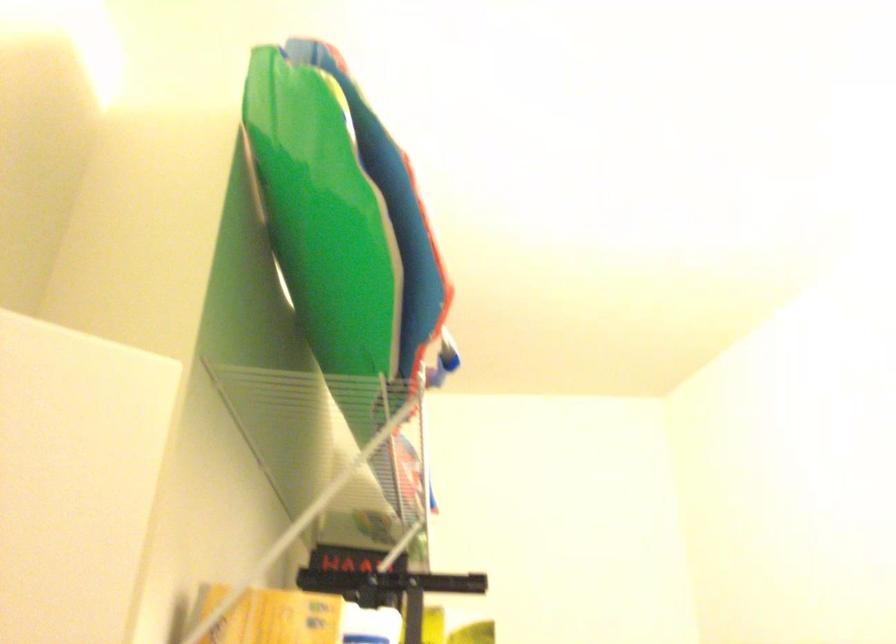
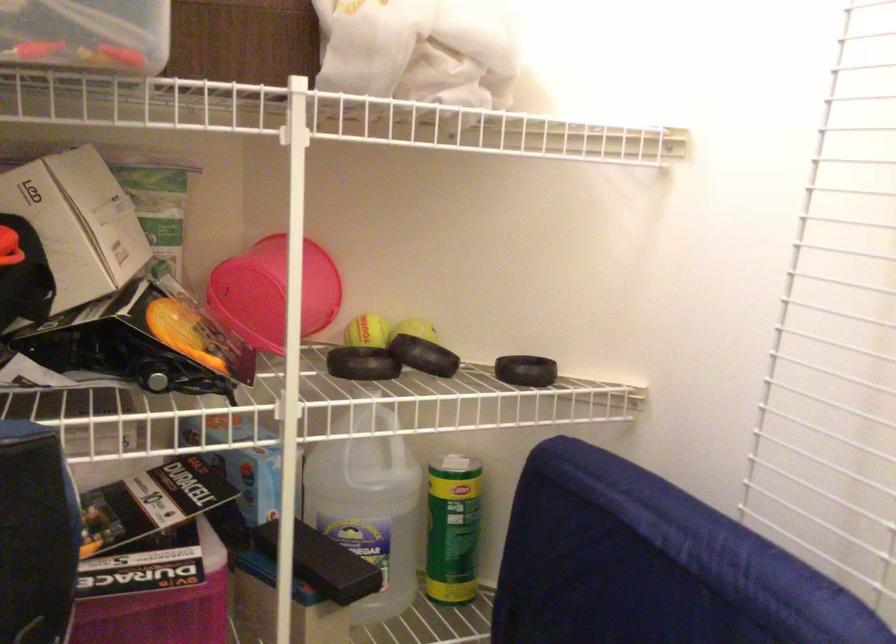
Question: The camera is either moving clockwise (left) or counter-clockwise (right) around the object. The first image is from the beginning of the video and the second image is from the end. Is the camera moving left or right when shooting the video?

Choices:
 (A) Left
 (B) Right

Answer: (B)